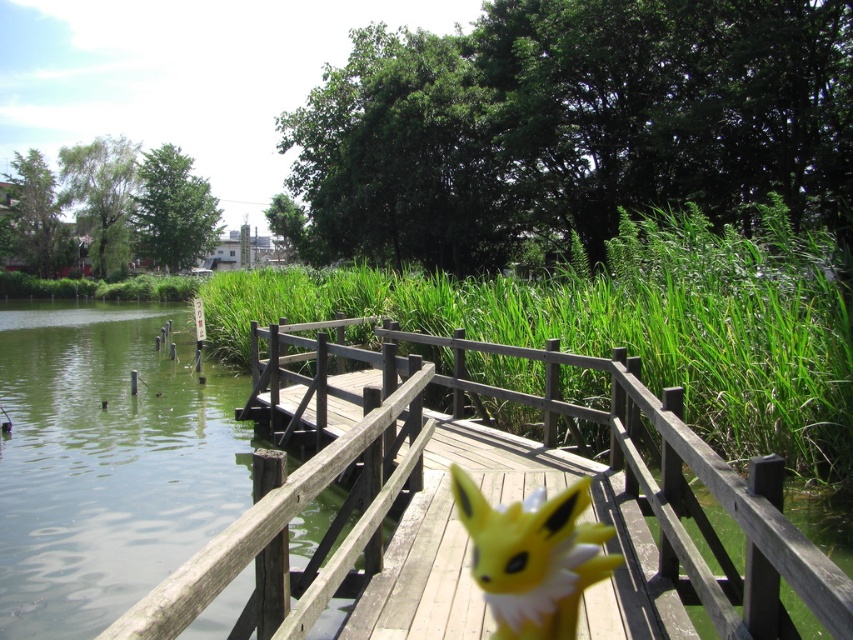
You are standing at the point with coordinates point [496,496]. Looking around, you see the wooden bridge at center. Which direction should you walk to reach the wooden bridge at center?

You are already at the wooden bridge at center, as the point [496,496] indicates that location.

You are a photographer trying to capture the wooden bridge at center and the yellow plush toy at center in a single shot. Based on their sizes in the image, which object would appear larger in your photo?

The yellow plush toy at center appears larger in the photo because the wooden bridge at center is smaller than it.

You are a photographer standing on the wooden bridge at center and want to take a photo of the yellow plush toy at center. Which direction should you move to get the toy into the frame?

The wooden bridge at center is positioned on the right side of the yellow plush toy at center, so you should move to the left to get the toy into the frame.